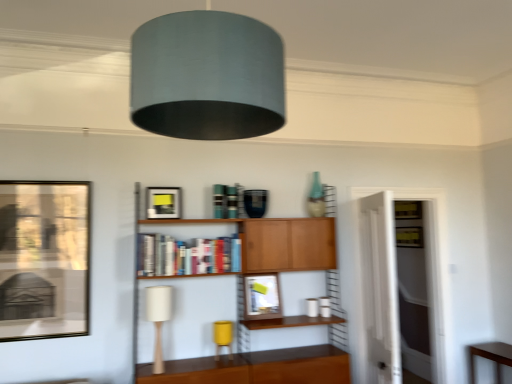
Question: Is matte black picture frame at upper center, which is counted as the second picture frame, starting from the back, in front of or behind brown wooden table at lower right in the image?

Choices:
 (A) front
 (B) behind

Answer: (A)

Question: Would you say matte black picture frame at upper center, positioned as the 2th picture frame in front-to-back order, is inside or outside brown wooden table at lower right?

Choices:
 (A) outside
 (B) inside

Answer: (A)

Question: Which is nearer to the wooden cabinet at center?

Choices:
 (A) yellow matte table lamp at lower center, the 2th table lamp in the front-to-back sequence
 (B) white fabric table lamp at lower left, the first table lamp from the left
 (C) hardcover books at center
 (D) matte black picture frame at upper center, positioned as the 2th picture frame in front-to-back order
 (E) matte black picture frame at left, which ranks as the first picture frame in front-to-back order

Answer: (A)

Question: Which of these objects is positioned closest to the matte glass picture frame at center, which is the 1th picture frame from back to front?

Choices:
 (A) matte black picture frame at left, which ranks as the first picture frame in front-to-back order
 (B) yellow matte table lamp at lower center, the 2th table lamp in the front-to-back sequence
 (C) matte black picture frame at upper center, which is the second picture frame in right-to-left order
 (D) transparent glass door at right
 (E) white fabric table lamp at lower left, arranged as the second table lamp when viewed from the back

Answer: (B)